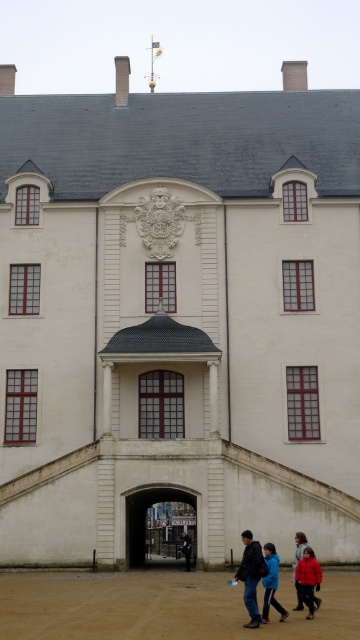
Question: Which object is the closest to the blue fabric jacket at lower center?

Choices:
 (A) dark blue jeans at lower center
 (B) blue denim jacket at center
 (C) red matte jacket at lower right

Answer: (A)

Question: Does dark blue jeans at lower center appear under blue denim jacket at center?

Choices:
 (A) yes
 (B) no

Answer: (B)

Question: Which object is positioned closest to the dark blue jeans at lower center?

Choices:
 (A) red matte jacket at lower right
 (B) blue fabric jacket at lower center

Answer: (B)

Question: Is red matte jacket at lower right above blue denim jacket at center?

Choices:
 (A) no
 (B) yes

Answer: (B)

Question: Is dark blue jeans at lower center closer to camera compared to blue fabric jacket at lower center?

Choices:
 (A) yes
 (B) no

Answer: (A)

Question: Among these objects, which one is nearest to the camera?

Choices:
 (A) dark blue jeans at lower center
 (B) blue fabric jacket at lower center

Answer: (A)